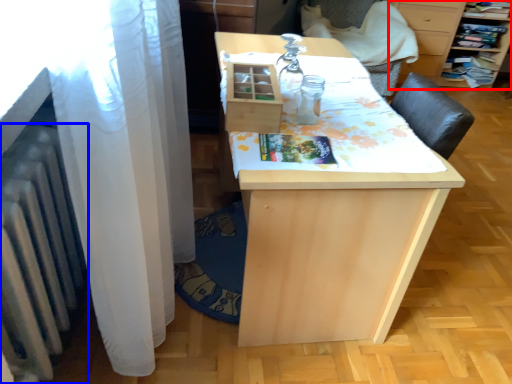
Question: Among these objects, which one is farthest to the camera, furniture (highlighted by a red box) or radiator (highlighted by a blue box)?

Choices:
 (A) furniture
 (B) radiator

Answer: (A)